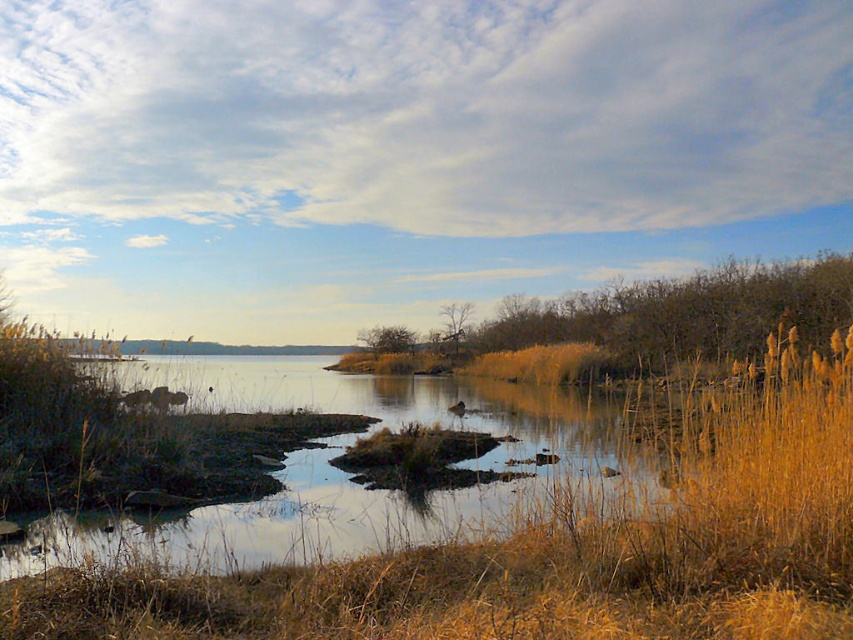
Question: Which point appears farthest from the camera in this image?

Choices:
 (A) (189, 529)
 (B) (450, 308)
 (C) (405, 348)

Answer: (B)

Question: Which of these objects is positioned closest to the green leafy tree at center?

Choices:
 (A) brown grassy river at center
 (B) brown textured tree at center

Answer: (B)

Question: Considering the relative positions of brown textured tree at right and brown textured tree at center in the image provided, where is brown textured tree at right located with respect to brown textured tree at center?

Choices:
 (A) above
 (B) below

Answer: (B)

Question: Which point is farther from the camera taking this photo?

Choices:
 (A) (409, 332)
 (B) (316, 451)
 (C) (802, 282)

Answer: (A)

Question: Does brown grassy river at center appear under brown textured tree at center?

Choices:
 (A) no
 (B) yes

Answer: (B)

Question: Does brown textured tree at right have a smaller size compared to green leafy tree at center?

Choices:
 (A) yes
 (B) no

Answer: (B)